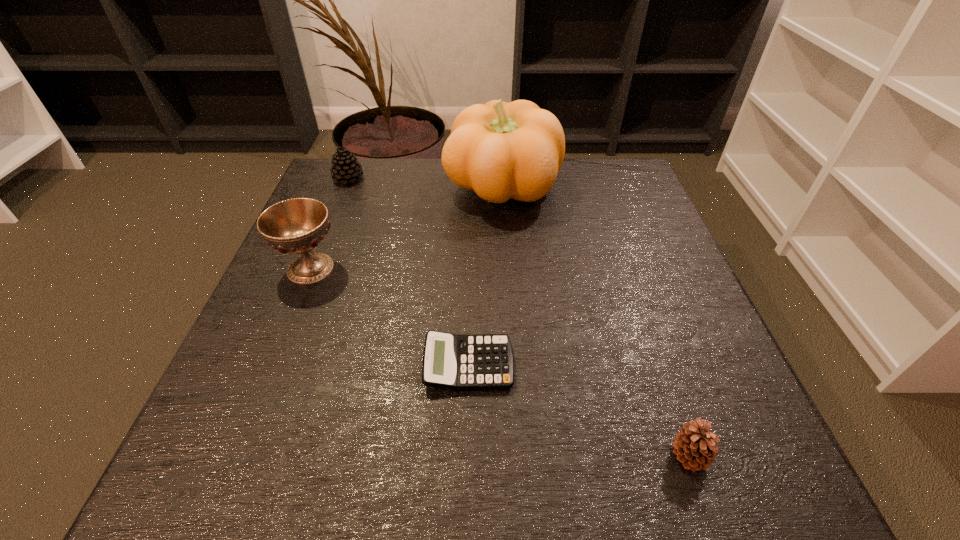
Where is `free area in between the left pinecone and the right pinecone`? This screenshot has height=540, width=960. free area in between the left pinecone and the right pinecone is located at coordinates (518, 317).

Where is `free area in between the tallest object and the second tallest object`? free area in between the tallest object and the second tallest object is located at coordinates (406, 228).

Find the location of a particular element. vacant area that lies between the pumpkin and the farther pinecone is located at coordinates (425, 183).

You are a GUI agent. You are given a task and a screenshot of the screen. Output one action in this format:
    pyautogui.click(x=<x>, y=<y>)
    Task: Click on the vacant space that's between the tallest object and the farther pinecone
    Image resolution: width=960 pixels, height=540 pixels.
    Given the screenshot: What is the action you would take?
    pyautogui.click(x=425, y=183)

Find the location of `the fourth closest object to the pumpkin`. the fourth closest object to the pumpkin is located at coordinates (694, 445).

At what (x,y) coordinates should I click in order to perform the action: click on the closest object to the calculator. Please return your answer as a coordinate pair (x, y). Looking at the image, I should click on (694, 445).

You are a GUI agent. You are given a task and a screenshot of the screen. Output one action in this format:
    pyautogui.click(x=<x>, y=<y>)
    Task: Click on the vacant area in the image that satisfies the following two spatial constraints: 1. on the front side of the fourth shortest object; 2. on the right side of the rightmost object
    The image size is (960, 540).
    Given the screenshot: What is the action you would take?
    pyautogui.click(x=234, y=456)

At what (x,y) coordinates should I click in order to perform the action: click on vacant space that satisfies the following two spatial constraints: 1. at the narrow end of the rightmost object; 2. on the right side of the left pinecone. Please return your answer as a coordinate pair (x, y). Looking at the image, I should click on (237, 456).

This screenshot has width=960, height=540. I want to click on blank area in the image that satisfies the following two spatial constraints: 1. at the narrow end of the nearest object; 2. on the right side of the left pinecone, so click(x=237, y=456).

Locate an element on the screen. free space that satisfies the following two spatial constraints: 1. at the narrow end of the rightmost object; 2. on the left side of the left pinecone is located at coordinates (237, 456).